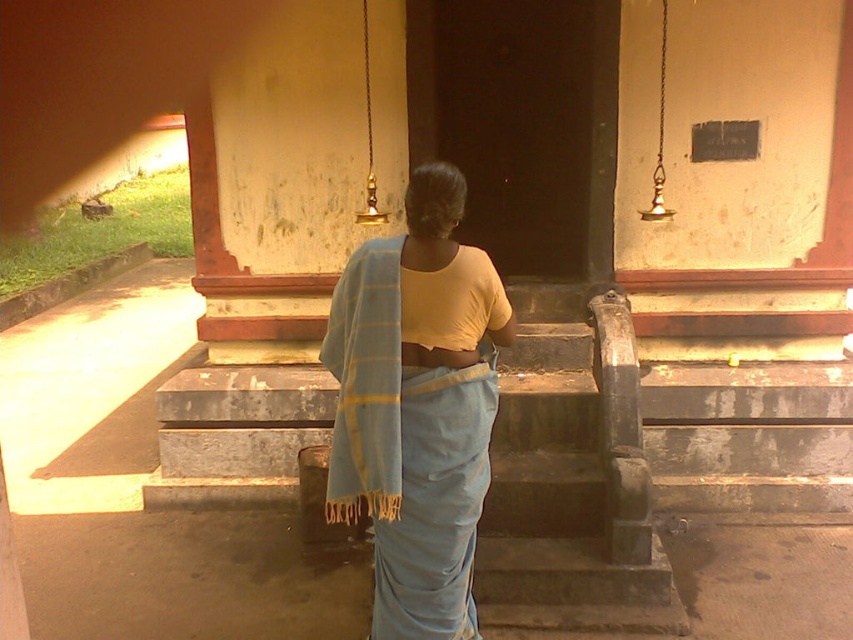
You are a photographer trying to capture the details of the light blue fabric at center and the light blue woven shawl at center worn by the person in the temple entrance. Which item is closer to the camera?

The light blue woven shawl at center is closer to the camera because it is positioned over the light blue fabric at center.

You are a photographer trying to capture the person in the scene. The light blue fabric at center and the light blue woven shawl at center are both part of their outfit. Which item has a greater width when viewed from your camera angle?

The light blue fabric at center has a greater width than the light blue woven shawl at center.